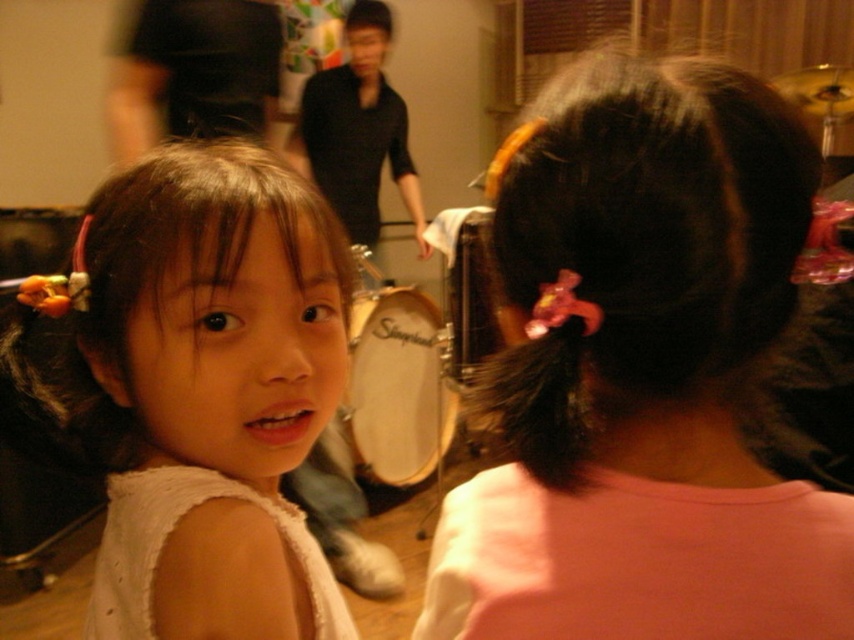
Question: Which point appears closest to the camera in this image?

Choices:
 (A) (209, 474)
 (B) (730, 124)
 (C) (202, 472)
 (D) (636, 499)

Answer: (B)

Question: Does dark brown silky hair at upper right have a smaller size compared to white lace dress at lower left?

Choices:
 (A) yes
 (B) no

Answer: (A)

Question: Is dark brown silky hair at upper right positioned before white lace dress at lower left?

Choices:
 (A) no
 (B) yes

Answer: (B)

Question: Can you confirm if matte white dress at left is wider than pink cotton dress at back?

Choices:
 (A) yes
 (B) no

Answer: (A)

Question: Which point is farther from the camera taking this photo?

Choices:
 (A) pyautogui.click(x=253, y=500)
 (B) pyautogui.click(x=582, y=515)
 (C) pyautogui.click(x=557, y=429)
 (D) pyautogui.click(x=284, y=596)

Answer: (A)

Question: Which point is closer to the camera taking this photo?

Choices:
 (A) (706, 566)
 (B) (168, 563)
 (C) (691, 218)
 (D) (284, 528)

Answer: (C)